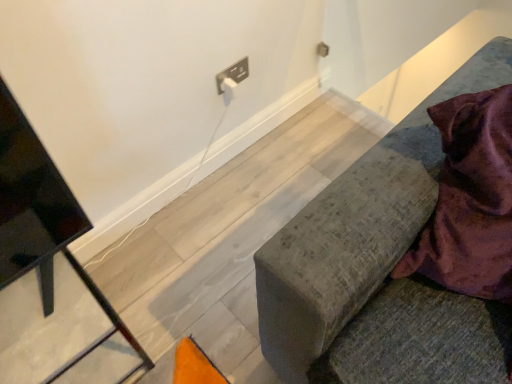
Question: Considering the relative sizes of velvet grey cushion at right, marked as the first furniture in a right-to-left arrangement, and velvet purple blanket at right in the image provided, is velvet grey cushion at right, marked as the first furniture in a right-to-left arrangement, taller than velvet purple blanket at right?

Choices:
 (A) no
 (B) yes

Answer: (B)

Question: From a real-world perspective, is velvet grey cushion at right, marked as the first furniture in a right-to-left arrangement, physically above velvet purple blanket at right?

Choices:
 (A) no
 (B) yes

Answer: (A)

Question: Is velvet grey cushion at right, which is the 2th furniture from left to right, positioned behind velvet purple blanket at right?

Choices:
 (A) yes
 (B) no

Answer: (B)

Question: Can you confirm if velvet grey cushion at right, which is the 2th furniture from left to right, is shorter than velvet purple blanket at right?

Choices:
 (A) no
 (B) yes

Answer: (A)

Question: From a real-world perspective, is velvet grey cushion at right, which is the 2th furniture from left to right, positioned under velvet purple blanket at right based on gravity?

Choices:
 (A) no
 (B) yes

Answer: (B)

Question: From the image's perspective, is velvet grey cushion at right, which is the 2th furniture from left to right, above velvet purple blanket at right?

Choices:
 (A) yes
 (B) no

Answer: (B)

Question: From a real-world perspective, is velvet purple blanket at right on velvet grey cushion at right, which is the 2th furniture from left to right?

Choices:
 (A) yes
 (B) no

Answer: (A)

Question: Does velvet purple blanket at right have a greater width compared to velvet grey cushion at right, marked as the first furniture in a right-to-left arrangement?

Choices:
 (A) no
 (B) yes

Answer: (A)

Question: Is the position of velvet purple blanket at right more distant than that of velvet grey cushion at right, marked as the first furniture in a right-to-left arrangement?

Choices:
 (A) yes
 (B) no

Answer: (A)

Question: Does velvet purple blanket at right have a smaller size compared to velvet grey cushion at right, which is the 2th furniture from left to right?

Choices:
 (A) yes
 (B) no

Answer: (A)

Question: Is velvet purple blanket at right far from velvet grey cushion at right, which is the 2th furniture from left to right?

Choices:
 (A) yes
 (B) no

Answer: (B)

Question: From the image's perspective, does velvet purple blanket at right appear higher than velvet grey cushion at right, which is the 2th furniture from left to right?

Choices:
 (A) no
 (B) yes

Answer: (B)

Question: Considering the relative positions of velvet grey cushion at right, which is the 2th furniture from left to right, and black metal tv stand at left, acting as the 1th furniture starting from the left, in the image provided, is velvet grey cushion at right, which is the 2th furniture from left to right, to the left of black metal tv stand at left, acting as the 1th furniture starting from the left, from the viewer's perspective?

Choices:
 (A) yes
 (B) no

Answer: (B)